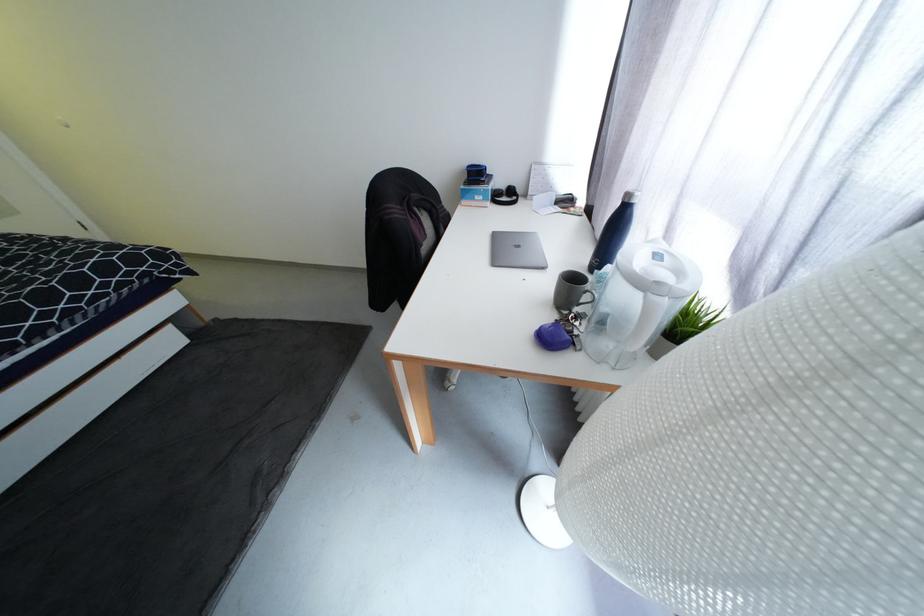
Which object does [505,196] point to?

It refers to a black headphones.